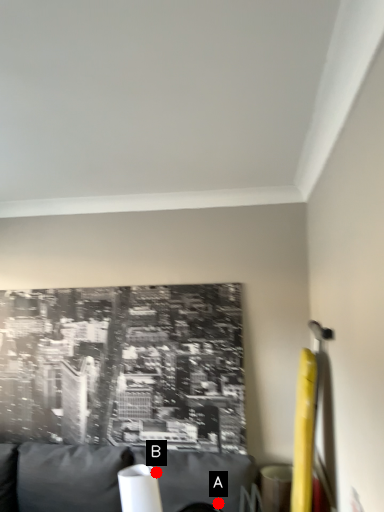
Question: Two points are circled on the image, labeled by A and B beside each circle. Among these points, which one is farthest from the camera?

Choices:
 (A) A is further
 (B) B is further

Answer: (B)